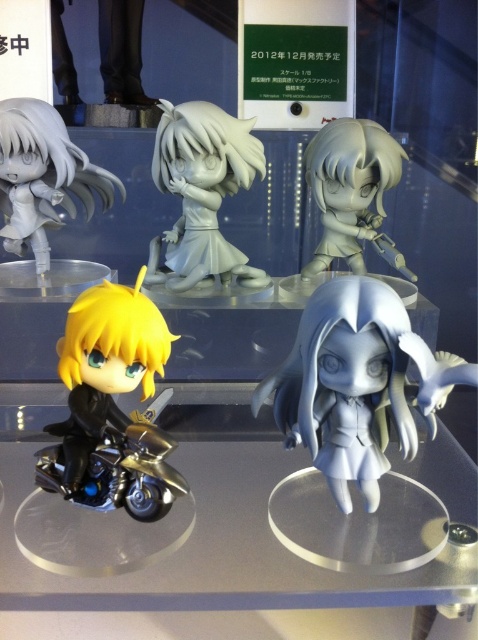
Question: Estimate the real-world distances between objects in this image. Which object is farther from the shiny gold motorcycle at lower left?

Choices:
 (A) clear acrylic glass table at lower center
 (B) satin white figure at center
 (C) shiny metallic motorcycle at lower left

Answer: (A)

Question: Can you confirm if shiny gold motorcycle at lower left is smaller than gray matte figure at center?

Choices:
 (A) no
 (B) yes

Answer: (B)

Question: Where is satin white figure at center located in relation to shiny metallic motorcycle at lower left in the image?

Choices:
 (A) below
 (B) above

Answer: (B)

Question: Which object appears farthest from the camera in this image?

Choices:
 (A) satin white figure at center
 (B) shiny gold motorcycle at lower left

Answer: (B)

Question: Which object is the farthest from the semi-glossy gray figure at upper center?

Choices:
 (A) clear acrylic glass table at lower center
 (B) satin silver figure at upper left
 (C) satin white figure at center

Answer: (A)

Question: Does satin white figure at center have a lesser width compared to gray matte figure at center?

Choices:
 (A) no
 (B) yes

Answer: (A)